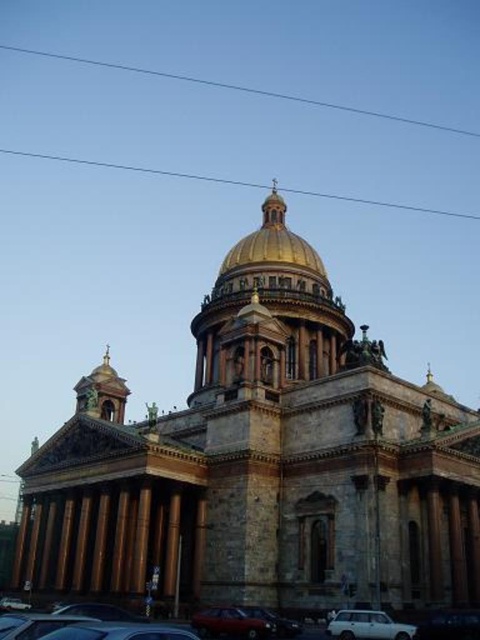
Question: Which point is farther to the camera?

Choices:
 (A) shiny red car at lower center
 (B) stone church at center

Answer: (B)

Question: Does clear blue wire at upper center have a lesser width compared to metallic silver car at lower left?

Choices:
 (A) no
 (B) yes

Answer: (A)

Question: Is metallic silver car at lower center to the left of shiny red car at lower center from the viewer's perspective?

Choices:
 (A) no
 (B) yes

Answer: (B)

Question: Among these objects, which one is nearest to the camera?

Choices:
 (A) stone church at center
 (B) metallic silver car at lower center
 (C) clear blue wire at upper center
 (D) white matte car at lower center

Answer: (B)

Question: Among these objects, which one is farthest from the camera?

Choices:
 (A) clear wire at upper center
 (B) white glossy car at lower center
 (C) shiny red car at lower center
 (D) clear blue wire at upper center

Answer: (D)

Question: Does metallic silver car at lower center have a lesser width compared to metallic silver car at lower left?

Choices:
 (A) yes
 (B) no

Answer: (A)